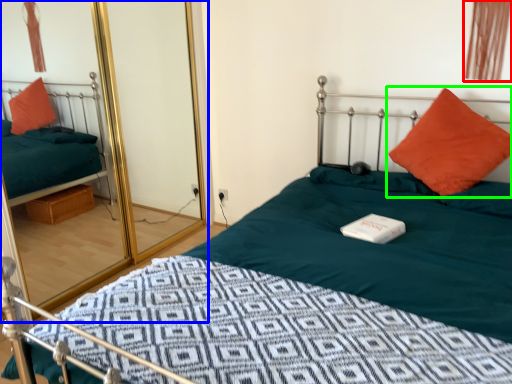
Question: Considering the real-world distances, which object is closest to curtain (highlighted by a red box)? glass door (highlighted by a blue box) or pillow (highlighted by a green box).

Choices:
 (A) glass door
 (B) pillow

Answer: (B)